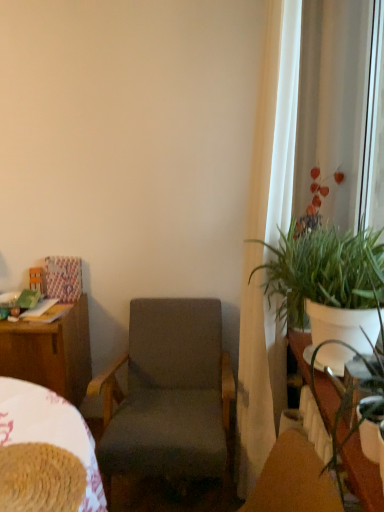
Question: Is the depth of white glossy table at right greater than that of dark gray fabric chair at center?

Choices:
 (A) no
 (B) yes

Answer: (A)

Question: From the image's perspective, is white glossy table at right above dark gray fabric chair at center?

Choices:
 (A) yes
 (B) no

Answer: (A)

Question: Does white glossy table at right have a greater width compared to dark gray fabric chair at center?

Choices:
 (A) yes
 (B) no

Answer: (B)

Question: Considering the relative sizes of white glossy table at right and dark gray fabric chair at center in the image provided, is white glossy table at right thinner than dark gray fabric chair at center?

Choices:
 (A) no
 (B) yes

Answer: (B)

Question: Does white glossy table at right come in front of dark gray fabric chair at center?

Choices:
 (A) yes
 (B) no

Answer: (A)

Question: Is white glossy table at right taller than dark gray fabric chair at center?

Choices:
 (A) yes
 (B) no

Answer: (B)

Question: Can you confirm if green leafy plant at right is positioned to the right of dark gray fabric chair at center?

Choices:
 (A) no
 (B) yes

Answer: (B)

Question: Is green leafy plant at right further to camera compared to dark gray fabric chair at center?

Choices:
 (A) no
 (B) yes

Answer: (A)

Question: Does green leafy plant at right have a smaller size compared to dark gray fabric chair at center?

Choices:
 (A) yes
 (B) no

Answer: (A)

Question: Is green leafy plant at right wider than dark gray fabric chair at center?

Choices:
 (A) no
 (B) yes

Answer: (A)

Question: Is green leafy plant at right oriented away from dark gray fabric chair at center?

Choices:
 (A) no
 (B) yes

Answer: (A)

Question: Is green leafy plant at right bigger than dark gray fabric chair at center?

Choices:
 (A) no
 (B) yes

Answer: (A)

Question: Is green leafy plant at right positioned in front of white sheer curtain at right?

Choices:
 (A) no
 (B) yes

Answer: (B)